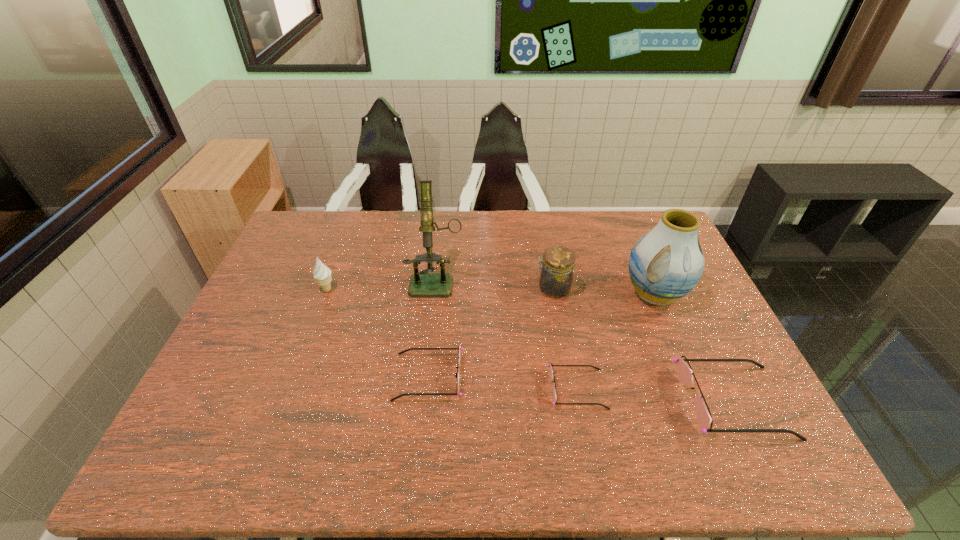
Find the location of `free region located 0.170m on the bridge of the leftmost sunglasses`. free region located 0.170m on the bridge of the leftmost sunglasses is located at coordinates (328, 377).

At what (x,y) coordinates should I click in order to perform the action: click on vacant area situated 0.110m on the bridge of the leftmost sunglasses. Please return your answer as a coordinate pair (x, y). The image size is (960, 540). Looking at the image, I should click on (351, 377).

Find the location of a particular element. The height and width of the screenshot is (540, 960). free space located 0.250m on the bridge of the leftmost sunglasses is located at coordinates (297, 377).

Locate an element on the screen. This screenshot has height=540, width=960. vacant space located 0.290m on the bridge of the shortest sunglasses is located at coordinates (722, 389).

At what (x,y) coordinates should I click in order to perform the action: click on free space located at the eyepiece of the microscope. Please return your answer as a coordinate pair (x, y). This screenshot has height=540, width=960. Looking at the image, I should click on (425, 381).

You are a GUI agent. You are given a task and a screenshot of the screen. Output one action in this format:
    pyautogui.click(x=<x>, y=<y>)
    Task: Click on the blank space located 0.050m on the left of the vase
    
    Given the screenshot: What is the action you would take?
    pyautogui.click(x=605, y=294)

Identify the location of vacant space located on the front-facing side of the leftmost object. (423, 289).

Find the location of `free point located 0.260m on the lid of the jar`. free point located 0.260m on the lid of the jar is located at coordinates (451, 289).

This screenshot has height=540, width=960. I want to click on free space located 0.060m on the lid of the jar, so click(516, 289).

Where is `free point located on the lid of the jar`? Image resolution: width=960 pixels, height=540 pixels. free point located on the lid of the jar is located at coordinates (464, 289).